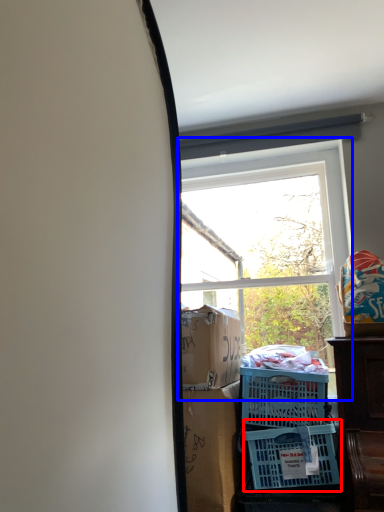
Question: Which object is closer to the camera taking this photo, basket (highlighted by a red box) or window (highlighted by a blue box)?

Choices:
 (A) basket
 (B) window

Answer: (A)